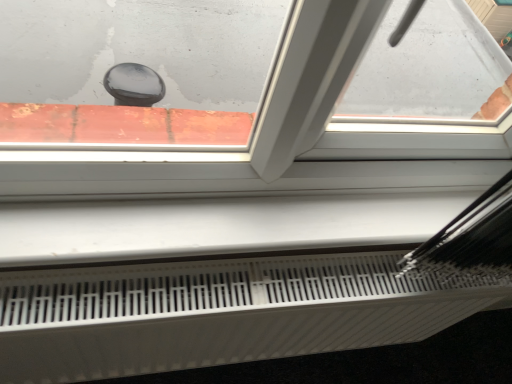
Describe the element at coordinates (219, 313) in the screenshot. This screenshot has height=384, width=512. I see `white plastic radiator at bottom` at that location.

The height and width of the screenshot is (384, 512). What are the coordinates of `white plastic radiator at bottom` in the screenshot? It's located at (219, 313).

Locate an element on the screen. The image size is (512, 384). white plastic radiator at bottom is located at coordinates (219, 313).